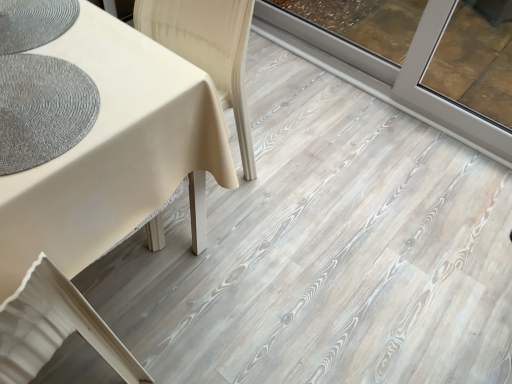
Question: Does white matte swivel chair at lower left have a greater height compared to textured gray mat at left?

Choices:
 (A) no
 (B) yes

Answer: (B)

Question: From the image's perspective, would you say white matte swivel chair at lower left is shown under textured gray mat at left?

Choices:
 (A) no
 (B) yes

Answer: (B)

Question: Does white matte swivel chair at lower left lie in front of textured gray mat at left?

Choices:
 (A) no
 (B) yes

Answer: (B)

Question: Is white matte swivel chair at lower left smaller than textured gray mat at left?

Choices:
 (A) no
 (B) yes

Answer: (A)

Question: Is white matte swivel chair at lower left wider than textured gray mat at left?

Choices:
 (A) yes
 (B) no

Answer: (A)

Question: Would you say white matte swivel chair at lower left is a long distance from textured gray mat at left?

Choices:
 (A) yes
 (B) no

Answer: (B)

Question: Is textured gray mat at left not within white matte swivel chair at lower left?

Choices:
 (A) no
 (B) yes

Answer: (B)

Question: Is textured gray mat at left positioned in front of white matte swivel chair at lower left?

Choices:
 (A) no
 (B) yes

Answer: (A)

Question: Considering the relative sizes of textured gray mat at left and white matte swivel chair at lower left in the image provided, is textured gray mat at left thinner than white matte swivel chair at lower left?

Choices:
 (A) yes
 (B) no

Answer: (A)

Question: Is textured gray mat at left next to white matte swivel chair at lower left?

Choices:
 (A) no
 (B) yes

Answer: (A)

Question: Is textured gray mat at left facing away from white matte swivel chair at lower left?

Choices:
 (A) no
 (B) yes

Answer: (A)

Question: Is the depth of textured gray mat at left greater than that of white matte swivel chair at lower left?

Choices:
 (A) no
 (B) yes

Answer: (B)

Question: Relative to white matte swivel chair at lower left, is textured gray mat at left in front or behind?

Choices:
 (A) front
 (B) behind

Answer: (B)